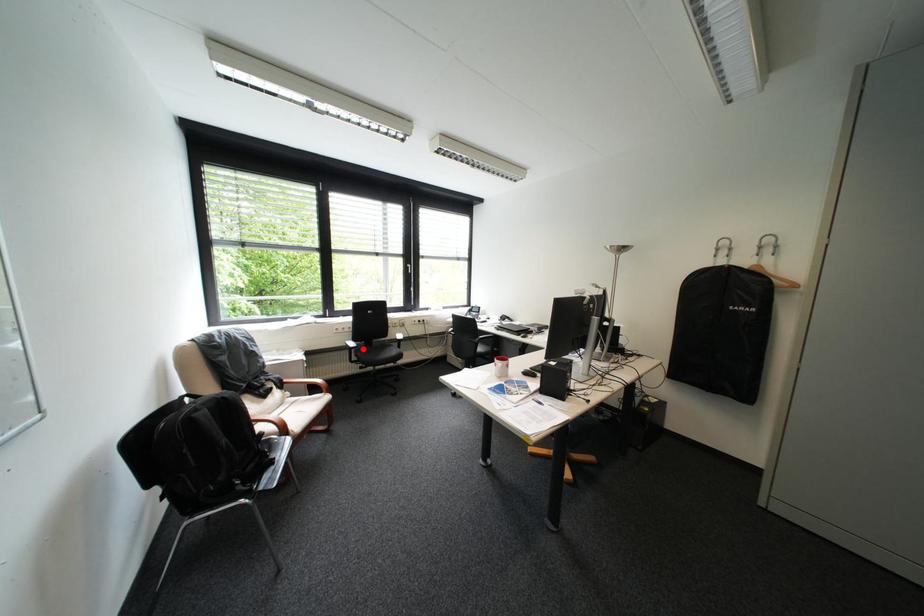
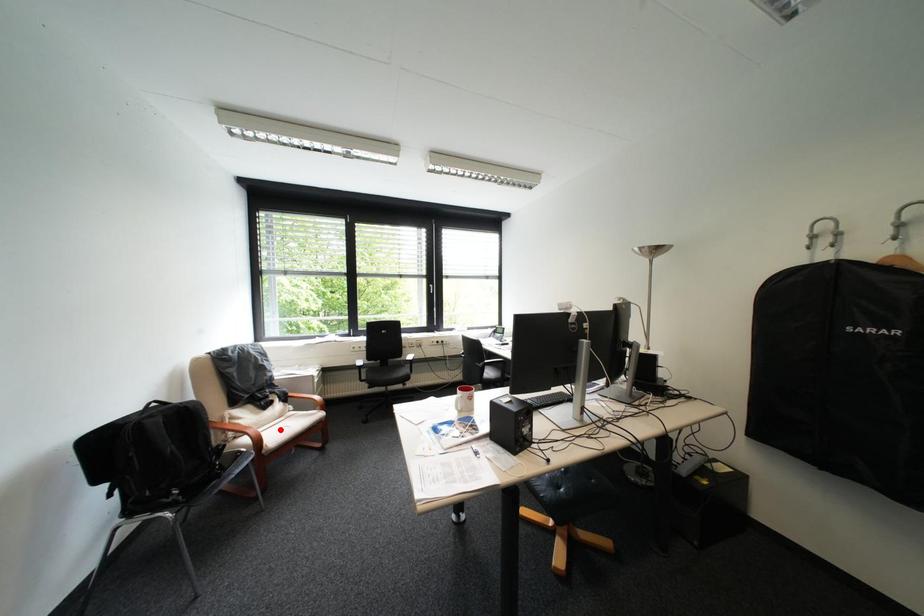
I am providing you with two images of the same scene from different viewpoints. A red point is marked on the first image and another point is marked on the second image. Are the points marked in image1 and image2 representing the same 3D position?

No